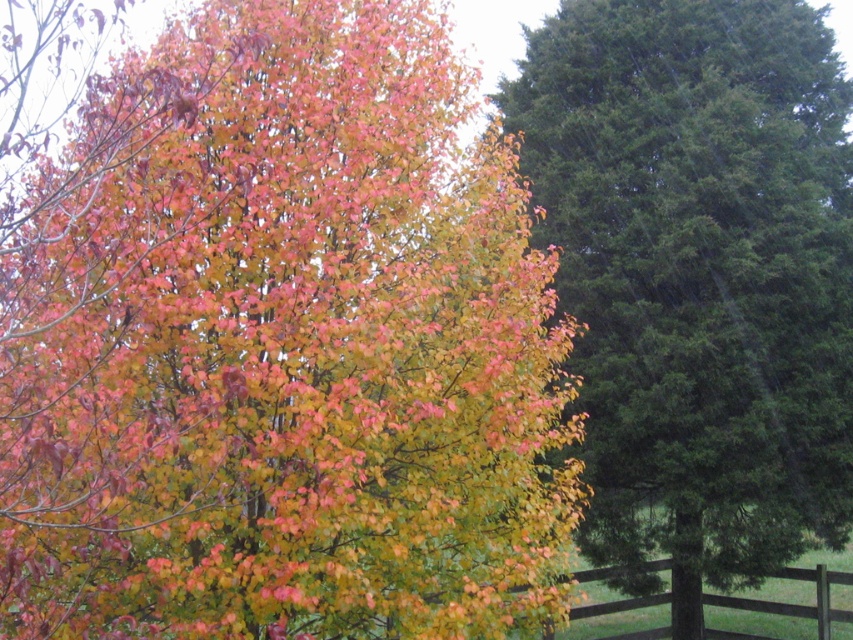
Is point (399, 509) closer to camera compared to point (781, 614)?

That is True.

Which of these two, multicolored foliage at center or brown wooden fence at lower right, stands shorter?

With less height is brown wooden fence at lower right.

Who is more forward, (67, 289) or (636, 608)?

Positioned in front is point (67, 289).

You are a GUI agent. You are given a task and a screenshot of the screen. Output one action in this format:
    pyautogui.click(x=<x>, y=<y>)
    Task: Click on the multicolored foliage at center
    Image resolution: width=853 pixels, height=640 pixels.
    Given the screenshot: What is the action you would take?
    pyautogui.click(x=281, y=348)

Measure the distance from green textured pine tree at right to brown wooden fence at lower right.

A distance of 2.52 meters exists between green textured pine tree at right and brown wooden fence at lower right.

Can you confirm if green textured pine tree at right is smaller than brown wooden fence at lower right?

Actually, green textured pine tree at right might be larger than brown wooden fence at lower right.

What do you see at coordinates (699, 275) in the screenshot?
I see `green textured pine tree at right` at bounding box center [699, 275].

Find the location of a particular element. green textured pine tree at right is located at coordinates (699, 275).

Between point (177, 170) and point (669, 452), which one is positioned in front?

Point (177, 170) is more forward.

Between multicolored foliage at center and green textured pine tree at right, which one has more height?

With more height is green textured pine tree at right.

Is point (320, 28) behind point (833, 172)?

No, it is not.

Where is `multicolored foliage at center`? The image size is (853, 640). multicolored foliage at center is located at coordinates (281, 348).